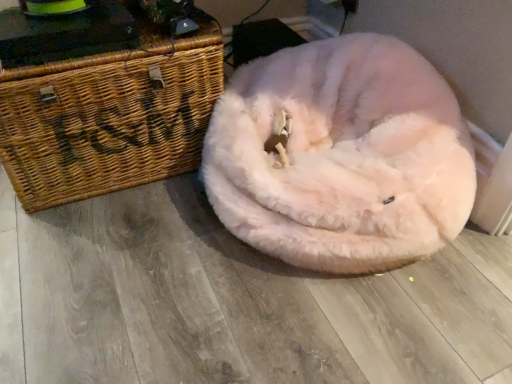
At what (x,y) coordinates should I click in order to perform the action: click on free space in front of fluffy pink dog bed at center. Please return your answer as a coordinate pair (x, y). This screenshot has width=512, height=384. Looking at the image, I should click on (326, 330).